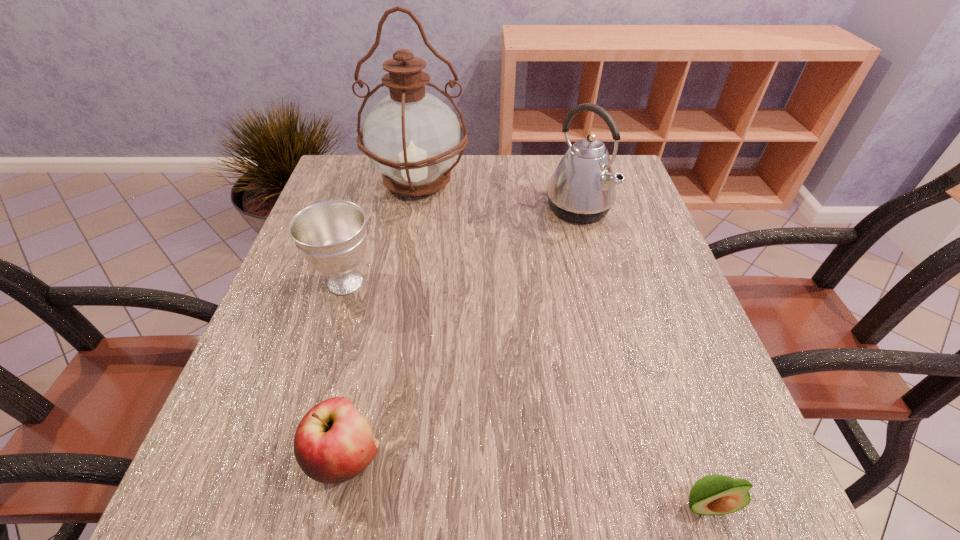
The width and height of the screenshot is (960, 540). What are the coordinates of `oil lamp present at the far edge` in the screenshot? It's located at (413, 138).

Where is `kettle located at the far edge`? This screenshot has height=540, width=960. kettle located at the far edge is located at coordinates (582, 189).

Where is `apple that is at the near edge`? The image size is (960, 540). apple that is at the near edge is located at coordinates (333, 443).

You are a GUI agent. You are given a task and a screenshot of the screen. Output one action in this format:
    pyautogui.click(x=<x>, y=<y>)
    Task: Click on the avocado that is at the near edge
    Image resolution: width=960 pixels, height=540 pixels.
    Given the screenshot: What is the action you would take?
    [x=715, y=494]

Find the location of a particular element. oil lamp that is at the left edge is located at coordinates (413, 138).

Identify the location of chalice at the left edge. This screenshot has height=540, width=960. (331, 235).

Locate an element on the screen. This screenshot has height=540, width=960. apple situated at the left edge is located at coordinates (333, 443).

Image resolution: width=960 pixels, height=540 pixels. I want to click on kettle at the right edge, so click(582, 189).

At what (x,y) coordinates should I click in order to perform the action: click on avocado situated at the right edge. Please return your answer as a coordinate pair (x, y). The image size is (960, 540). Looking at the image, I should click on click(715, 494).

Find the location of a particular element. The width and height of the screenshot is (960, 540). object at the far left corner is located at coordinates (413, 138).